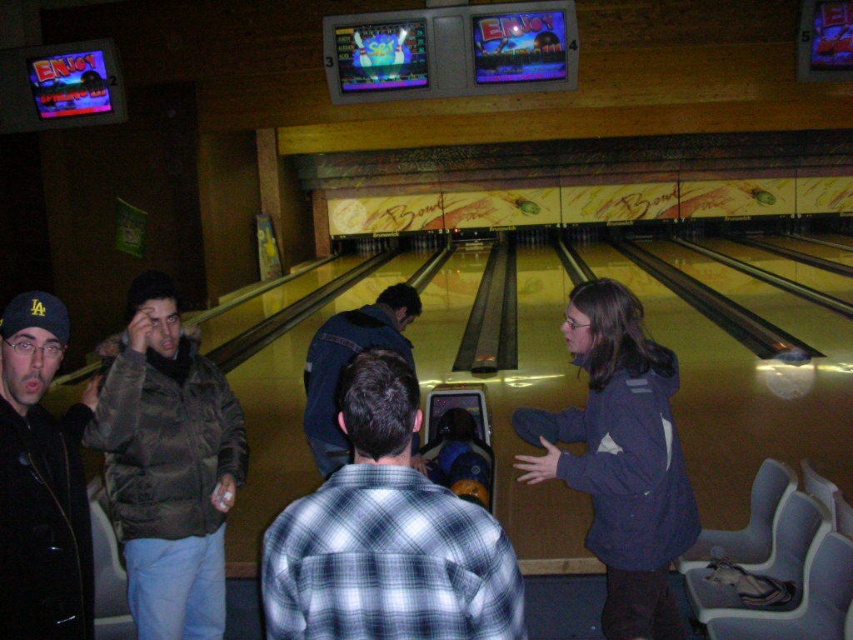
You are a photographer trying to capture a group photo of the people at the bowling alley. You notice the black matte jacket at left and the dark blue jeans at center. Which of these two items should you focus on if you want to include the wider object in your frame?

The dark blue jeans at center is wider than the black matte jacket at left, so you should focus on the dark blue jeans at center to include the wider object in your frame.

You are standing at the entrance of the bowling alley and see the plaid cotton shirt at center and the brown fuzzy jacket at left. Which person is closer to the entrance?

The brown fuzzy jacket at left is closer to the entrance because the plaid cotton shirt at center is above it, indicating it is positioned further back.